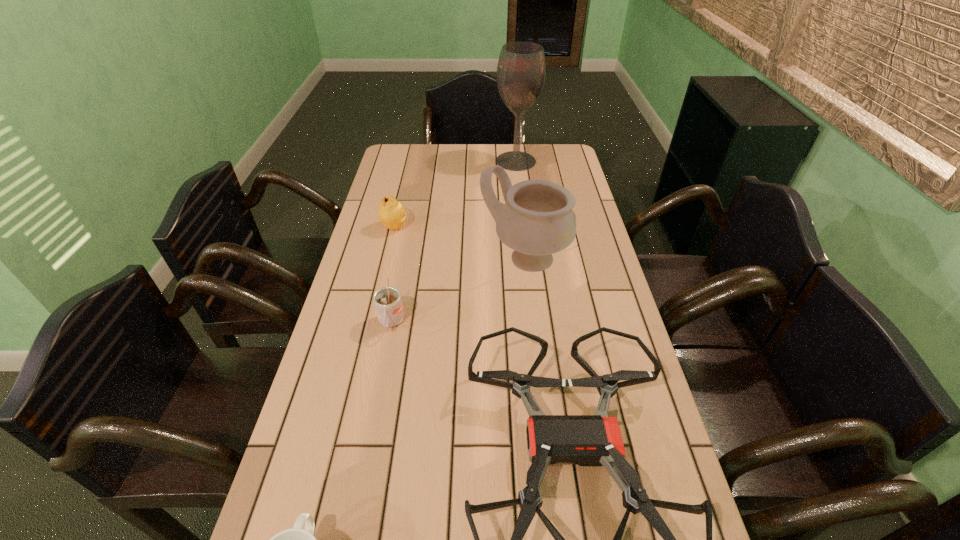
Point out which object is positioned as the nearest to the nearer cup. Please provide its 2D coordinates. Your answer should be formatted as a tuple, i.e. [(x, y)], where the tuple contains the x and y coordinates of a point satisfying the conditions above.

[(587, 440)]